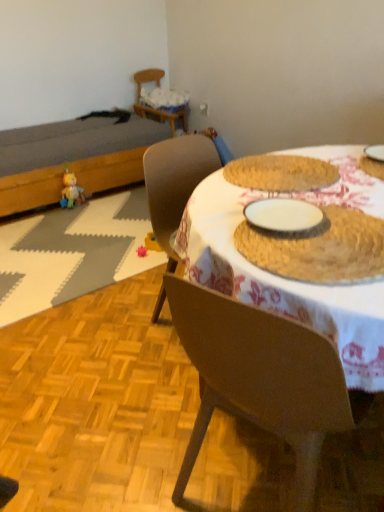
Locate an element on the screen. free region on the left part of pink fabric toy at lower center, arranged as the first toy when viewed from the right is located at coordinates (118, 256).